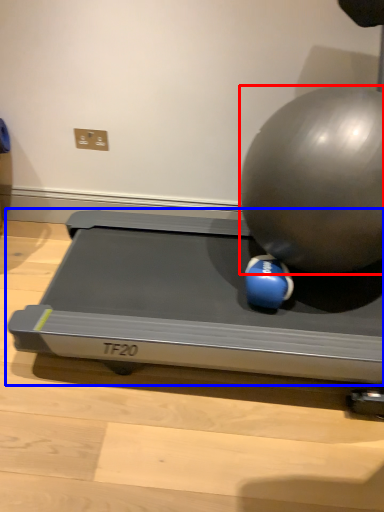
Question: Which point is further to the camera, ball (highlighted by a red box) or treadmill (highlighted by a blue box)?

Choices:
 (A) ball
 (B) treadmill

Answer: (B)